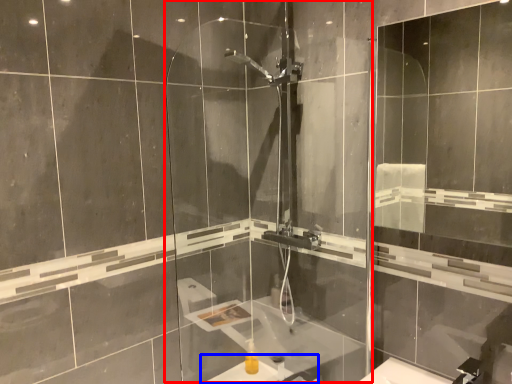
Question: Which object appears closest to the camera in this image, screen door (highlighted by a red box) or sink (highlighted by a blue box)?

Choices:
 (A) screen door
 (B) sink

Answer: (A)